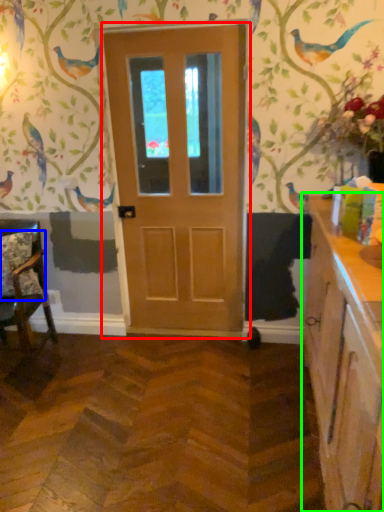
Question: Considering the real-world distances, which object is closest to door (highlighted by a red box)? pillow (highlighted by a blue box) or cabinetry (highlighted by a green box).

Choices:
 (A) pillow
 (B) cabinetry

Answer: (A)